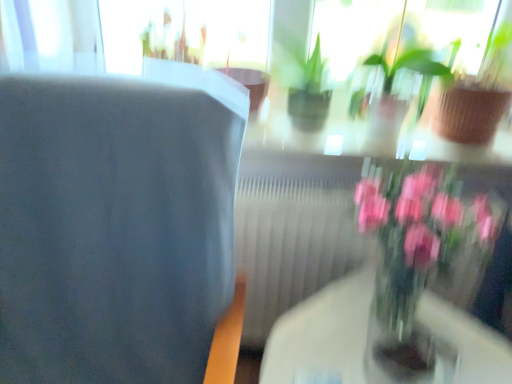
Where is `vacant space to the left of pink glass vase at right`? vacant space to the left of pink glass vase at right is located at coordinates (311, 339).